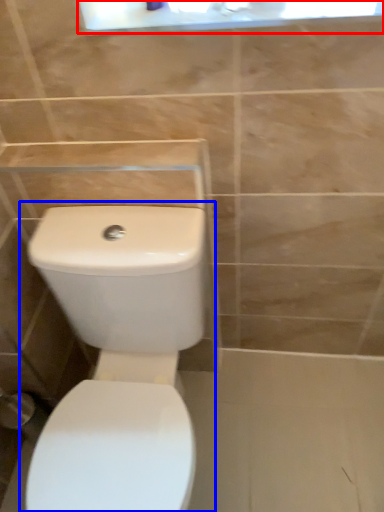
Question: Which of the following is the farthest to the observer, medicine cabinet (highlighted by a red box) or toilet (highlighted by a blue box)?

Choices:
 (A) medicine cabinet
 (B) toilet

Answer: (A)